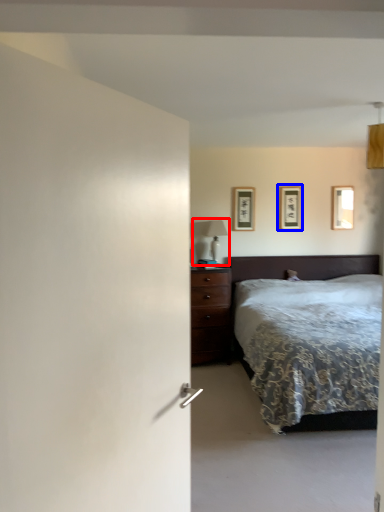
Question: Which object is closer to the camera taking this photo, table lamp (highlighted by a red box) or picture frame (highlighted by a blue box)?

Choices:
 (A) table lamp
 (B) picture frame

Answer: (A)